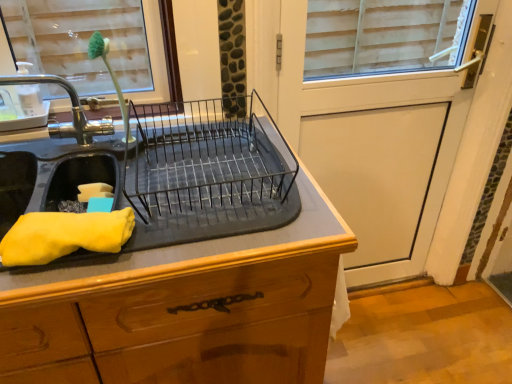
Find the location of `free space above yellow fabric at left (from a real-world perspective)`. free space above yellow fabric at left (from a real-world perspective) is located at coordinates (62, 223).